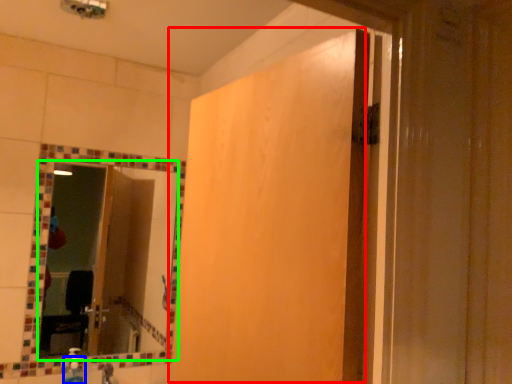
Question: Considering the real-world distances, which object is farthest from screen door (highlighted by a red box)? soap dispenser (highlighted by a blue box) or mirror (highlighted by a green box)?

Choices:
 (A) soap dispenser
 (B) mirror

Answer: (A)